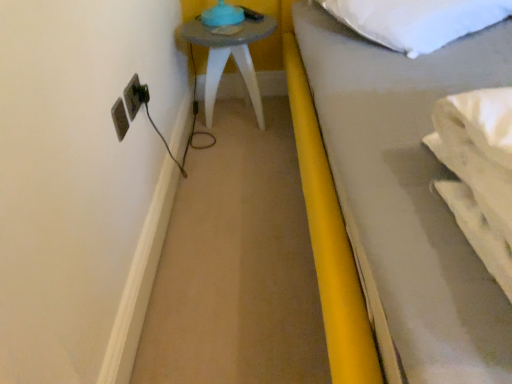
The width and height of the screenshot is (512, 384). What are the coordinates of `matte plastic electrical outlet at left` in the screenshot? It's located at (134, 96).

What do you see at coordinates (228, 57) in the screenshot? I see `matte gray side table at upper left` at bounding box center [228, 57].

I want to click on white soft pillow at upper right, so click(416, 20).

From a real-world perspective, is white soft pillow at upper right physically above matte gray side table at upper left?

Indeed, from a real-world perspective, white soft pillow at upper right stands above matte gray side table at upper left.

Is white soft pillow at upper right turned away from matte gray side table at upper left?

No, white soft pillow at upper right is not facing the opposite direction of matte gray side table at upper left.

From the image's perspective, is white soft pillow at upper right over matte gray side table at upper left?

Yes, from the image's perspective, white soft pillow at upper right is on top of matte gray side table at upper left.

Looking at the image, does white soft pillow at upper right seem bigger or smaller compared to matte gray side table at upper left?

Clearly, white soft pillow at upper right is smaller in size than matte gray side table at upper left.

Is white soft pillow at upper right far away from matte plastic electrical outlet at left?

Actually, white soft pillow at upper right and matte plastic electrical outlet at left are a little close together.

Is white soft pillow at upper right bigger or smaller than matte plastic electrical outlet at left?

Considering their sizes, white soft pillow at upper right takes up more space than matte plastic electrical outlet at left.

From a real-world perspective, is white soft pillow at upper right positioned above or below matte plastic electrical outlet at left?

Result: In terms of real-world spatial position, white soft pillow at upper right is above matte plastic electrical outlet at left.

Is white soft pillow at upper right at the left side of matte plastic electrical outlet at left?

Incorrect, white soft pillow at upper right is not on the left side of matte plastic electrical outlet at left.

Between matte plastic electrical outlet at left and matte gray side table at upper left, which one has larger width?

Wider between the two is matte gray side table at upper left.

From the image's perspective, is matte plastic electrical outlet at left above matte gray side table at upper left?

No, from the image's perspective, matte plastic electrical outlet at left is not on top of matte gray side table at upper left.

Is matte plastic electrical outlet at left turned away from matte gray side table at upper left?

That's not correct — matte plastic electrical outlet at left is not looking away from matte gray side table at upper left.

Is matte plastic electrical outlet at left in contact with matte gray side table at upper left?

No, matte plastic electrical outlet at left is not making contact with matte gray side table at upper left.

From the image's perspective, is matte gray side table at upper left positioned above or below white soft pillow at upper right?

matte gray side table at upper left is situated lower than white soft pillow at upper right in the image.

There is a matte gray side table at upper left. Where is `pillow above it (from a real-world perspective)`? This screenshot has width=512, height=384. pillow above it (from a real-world perspective) is located at coordinates (416, 20).

Is matte gray side table at upper left looking in the opposite direction of white soft pillow at upper right?

No, matte gray side table at upper left is not facing the opposite direction of white soft pillow at upper right.

In the scene shown: From their relative heights in the image, would you say matte gray side table at upper left is taller or shorter than matte plastic electrical outlet at left?

matte gray side table at upper left is taller than matte plastic electrical outlet at left.

From a real-world perspective, which object stands above the other?

matte plastic electrical outlet at left, from a real-world perspective.

Is matte gray side table at upper left bigger than matte plastic electrical outlet at left?

Correct, matte gray side table at upper left is larger in size than matte plastic electrical outlet at left.

The image size is (512, 384). I want to click on electric outlet in front of the matte gray side table at upper left, so click(134, 96).

Can you tell me how much matte plastic electrical outlet at left and white soft pillow at upper right differ in facing direction?

52.3 degrees.

Between matte plastic electrical outlet at left and white soft pillow at upper right, which one has less height?

matte plastic electrical outlet at left.

Is matte plastic electrical outlet at left positioned beyond the bounds of white soft pillow at upper right?

Yes, matte plastic electrical outlet at left is located beyond the bounds of white soft pillow at upper right.

Is matte plastic electrical outlet at left far away from white soft pillow at upper right?

No, matte plastic electrical outlet at left is not far away from white soft pillow at upper right.

Image resolution: width=512 pixels, height=384 pixels. I want to click on pillow on the right of matte gray side table at upper left, so click(416, 20).

At what (x,y) coordinates should I click in order to perform the action: click on pillow above the matte plastic electrical outlet at left (from a real-world perspective). Please return your answer as a coordinate pair (x, y). This screenshot has height=384, width=512. Looking at the image, I should click on (416, 20).

Which object lies nearer to the anchor point matte plastic electrical outlet at left, matte gray side table at upper left or white soft pillow at upper right?

The object closer to matte plastic electrical outlet at left is matte gray side table at upper left.

Considering their positions, is white soft pillow at upper right positioned closer to matte plastic electrical outlet at left than matte gray side table at upper left?

matte gray side table at upper left.

In the scene shown: Looking at the image, which one is located closer to white soft pillow at upper right, matte plastic electrical outlet at left or matte gray side table at upper left?

The object closer to white soft pillow at upper right is matte gray side table at upper left.

When comparing their distances from matte gray side table at upper left, does matte plastic electrical outlet at left or white soft pillow at upper right seem further?

matte plastic electrical outlet at left.

Considering their positions, is white soft pillow at upper right positioned further to matte gray side table at upper left than matte plastic electrical outlet at left?

matte plastic electrical outlet at left is further to matte gray side table at upper left.

Based on their spatial positions, is matte gray side table at upper left or matte plastic electrical outlet at left further from white soft pillow at upper right?

matte plastic electrical outlet at left lies further to white soft pillow at upper right than the other object.

This screenshot has height=384, width=512. I want to click on furniture between matte plastic electrical outlet at left and white soft pillow at upper right in the horizontal direction, so click(228, 57).